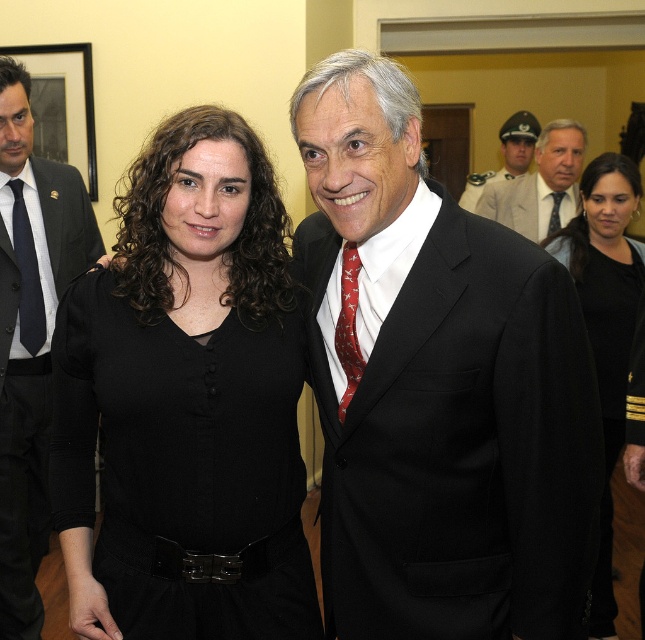
You are a photographer setting up for a group photo. You notice the black fabric dress at center and the light beige uniform at center. Which clothing item takes up more horizontal space in the frame?

The light beige uniform at center takes up more horizontal space in the frame because it has a greater width than the black fabric dress at center.

You are a photographer setting up for a group photo. You need to ensure that the dark gray suit at left and the red silk tie at center are both visible in the frame. Given their sizes, which object requires a wider angle to capture fully?

The dark gray suit at left requires a wider angle to capture fully because its width is larger than the red silk tie at center.